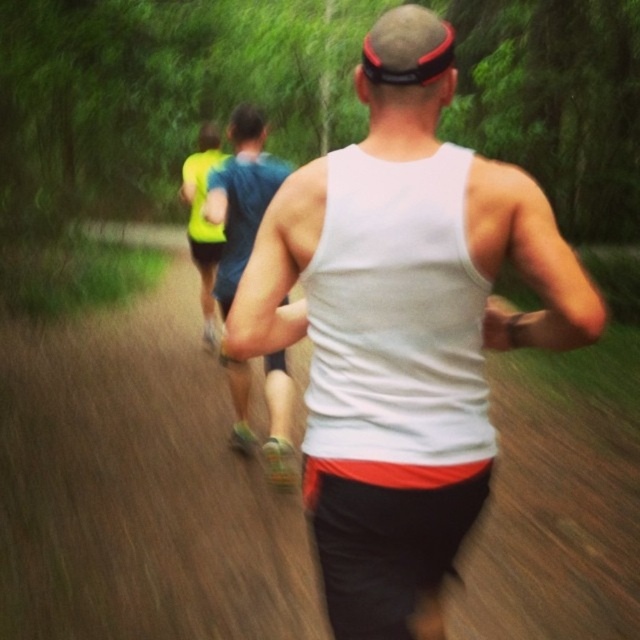
Is white matte tank top at center taller than blue fabric shirt at center?

Indeed, white matte tank top at center has a greater height compared to blue fabric shirt at center.

Is point (333, 301) positioned in front of point (250, 250)?

Yes, it is.

Image resolution: width=640 pixels, height=640 pixels. What are the coordinates of `white matte tank top at center` in the screenshot? It's located at (403, 328).

Which is behind, point (241, 419) or point (211, 310)?

The point (211, 310) is behind.

Which is behind, point (294, 476) or point (205, 289)?

Positioned behind is point (205, 289).

Where is `blue fabric shirt at center`? blue fabric shirt at center is located at coordinates (241, 196).

Which is behind, point (442, 305) or point (195, 248)?

Point (195, 248)

Who is taller, white matte tank top at center or neon yellow reflective vest at center?

neon yellow reflective vest at center

Which is in front, point (561, 321) or point (212, 252)?

Point (561, 321)

You are a GUI agent. You are given a task and a screenshot of the screen. Output one action in this format:
    pyautogui.click(x=<x>, y=<y>)
    Task: Click on the white matte tank top at center
    
    Given the screenshot: What is the action you would take?
    pyautogui.click(x=403, y=328)